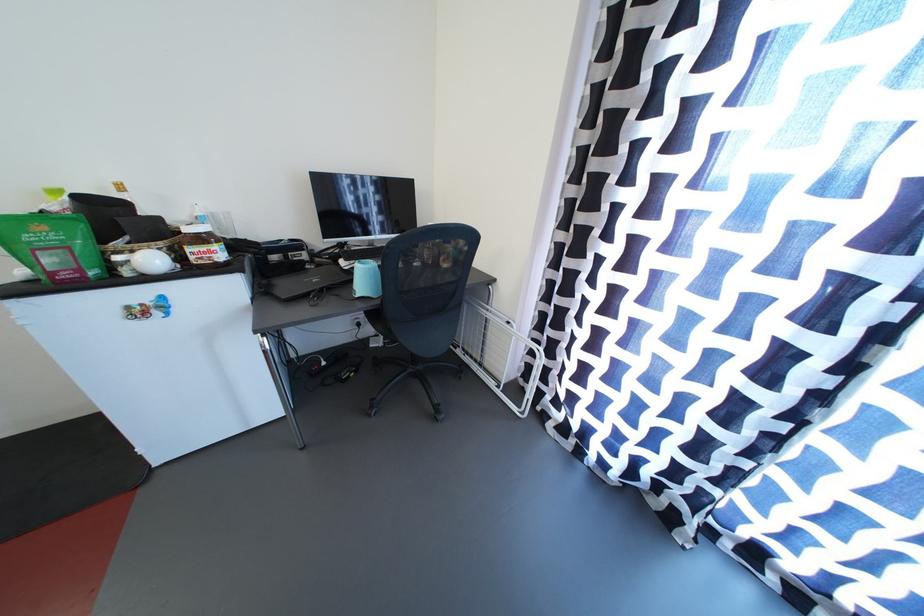
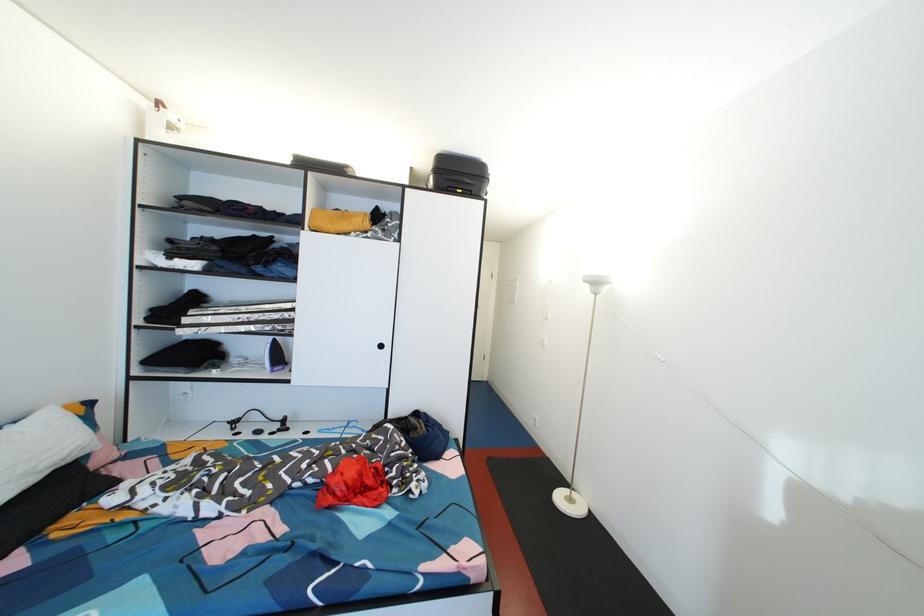
Question: The images are taken continuously from a first-person perspective. In which direction is your viewpoint rotating?

Choices:
 (A) Left
 (B) Right
 (C) Up
 (D) Down

Answer: (A)